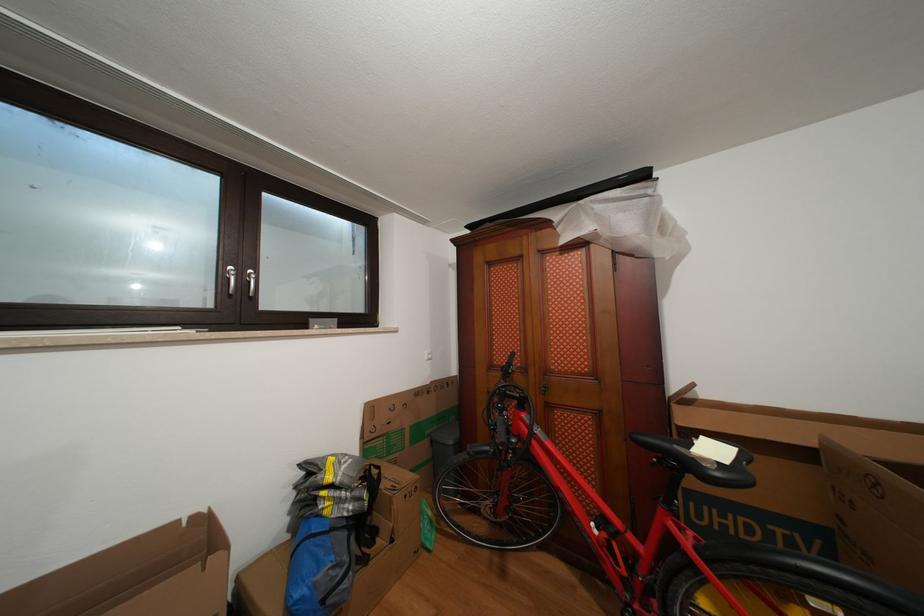
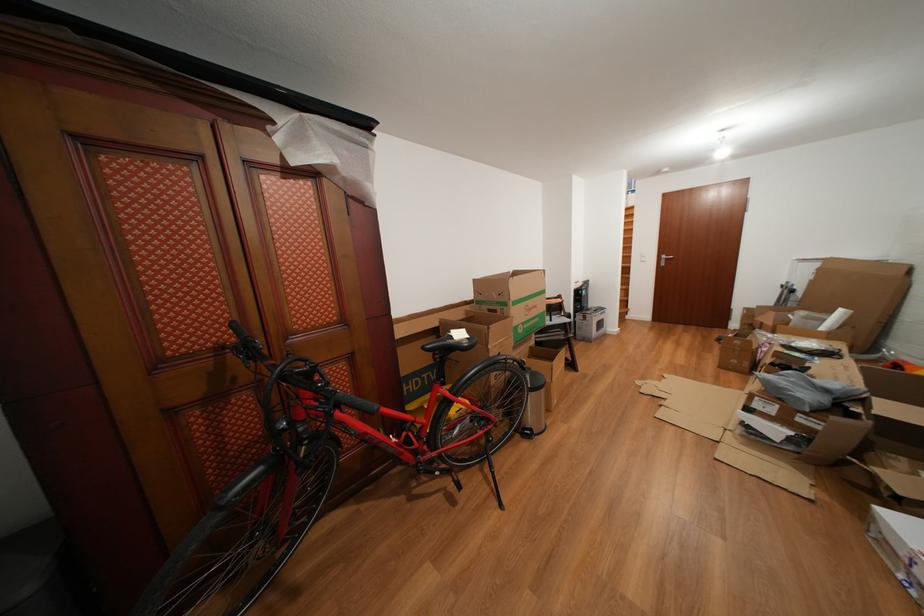
Where in the second image is the point corresponding to point 520,360 from the first image?

(241, 330)